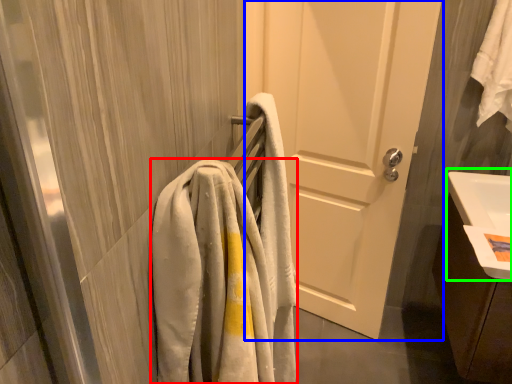
Question: Estimate the real-world distances between objects in this image. Which object is closer to towel (highlighted by a red box), door (highlighted by a blue box) or sink (highlighted by a green box)?

Choices:
 (A) door
 (B) sink

Answer: (B)